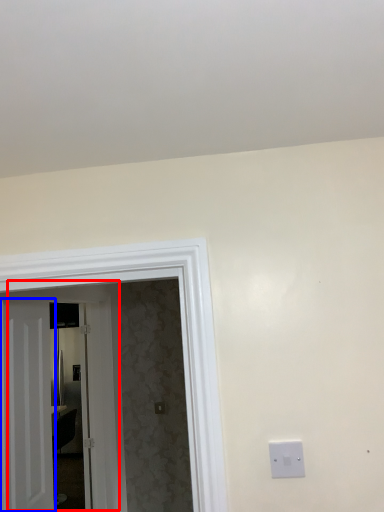
Question: Which of the following is the closest to the observer, door (highlighted by a red box) or door (highlighted by a blue box)?

Choices:
 (A) door
 (B) door

Answer: (A)